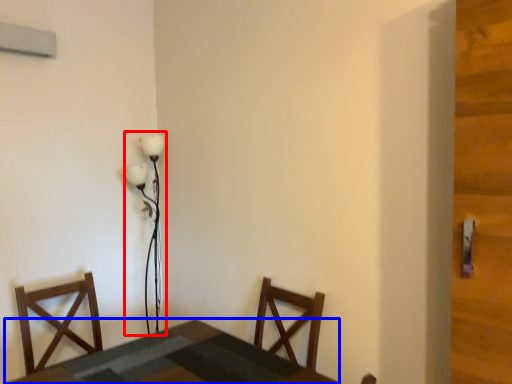
Question: Among these objects, which one is nearest to the camera, lamp (highlighted by a red box) or table (highlighted by a blue box)?

Choices:
 (A) lamp
 (B) table

Answer: (B)